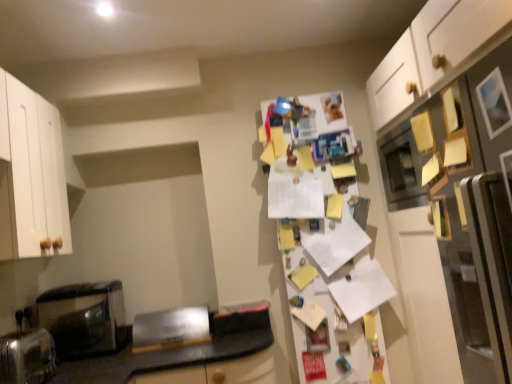
This screenshot has width=512, height=384. I want to click on brushed metal toaster at lower left, which is the first appliance from right to left, so click(170, 329).

Considering the points (55, 313) and (40, 372), which point is in front, point (55, 313) or point (40, 372)?

The point (40, 372) is in front.

Can you confirm if black glossy microwave at left is wider than satin silver toaster at lower left, arranged as the second appliance when viewed from the back?

Correct, the width of black glossy microwave at left exceeds that of satin silver toaster at lower left, arranged as the second appliance when viewed from the back.

From a real-world perspective, is black glossy microwave at left under satin silver toaster at lower left, placed as the first appliance when sorted from front to back?

Actually, black glossy microwave at left is physically above satin silver toaster at lower left, placed as the first appliance when sorted from front to back, in the real world.

Is white paper covered fridge at center, which ranks as the 1th fridge in back-to-front order, outside of white matte refrigerator at right, the second fridge when ordered from back to front?

Absolutely, white paper covered fridge at center, which ranks as the 1th fridge in back-to-front order, is external to white matte refrigerator at right, the second fridge when ordered from back to front.

Which object is wider, white paper covered fridge at center, the first fridge positioned from the left, or white matte refrigerator at right, the second fridge when ordered from back to front?

white matte refrigerator at right, the second fridge when ordered from back to front, is wider.

Which of these two, white paper covered fridge at center, the first fridge positioned from the left, or white matte refrigerator at right, which appears as the first fridge when viewed from the front, stands shorter?

white matte refrigerator at right, which appears as the first fridge when viewed from the front.

Identify the location of fridge behind the white matte refrigerator at right, the first fridge positioned from the right. (326, 249).

Looking at this image, is brushed metal toaster at lower left, which is the 2th appliance from front to back, facing away from white paper covered fridge at center, which ranks as the 1th fridge in back-to-front order?

No, brushed metal toaster at lower left, which is the 2th appliance from front to back, is not facing the opposite direction of white paper covered fridge at center, which ranks as the 1th fridge in back-to-front order.

The height and width of the screenshot is (384, 512). Identify the location of the 2nd fridge directly above the brushed metal toaster at lower left, which is the 2th appliance from front to back (from a real-world perspective). (326, 249).

Does point (143, 318) appear closer or farther from the camera than point (284, 214)?

Point (143, 318) is positioned closer to the camera compared to point (284, 214).

Is satin silver toaster at lower left, arranged as the second appliance when viewed from the back, closer to camera compared to black glossy microwave at left?

Yes, satin silver toaster at lower left, arranged as the second appliance when viewed from the back, is closer to the viewer.

Considering the relative sizes of satin silver toaster at lower left, the first appliance viewed from the left, and black glossy microwave at left in the image provided, is satin silver toaster at lower left, the first appliance viewed from the left, taller than black glossy microwave at left?

Incorrect, the height of satin silver toaster at lower left, the first appliance viewed from the left, is not larger of that of black glossy microwave at left.

Considering the positions of points (19, 358) and (102, 351), is point (19, 358) closer to camera compared to point (102, 351)?

That is True.

Considering the relative sizes of satin silver toaster at lower left, arranged as the second appliance when viewed from the back, and black glossy microwave at left in the image provided, is satin silver toaster at lower left, arranged as the second appliance when viewed from the back, thinner than black glossy microwave at left?

Yes.

Looking at this image, from the image's perspective, is brushed metal toaster at lower left, which is the first appliance from right to left, located beneath white matte refrigerator at right, the second fridge in the left-to-right sequence?

Correct, brushed metal toaster at lower left, which is the first appliance from right to left, appears lower than white matte refrigerator at right, the second fridge in the left-to-right sequence, in the image.

Would you say brushed metal toaster at lower left, which is the 2th appliance from front to back, is a long distance from white matte refrigerator at right, which appears as the first fridge when viewed from the front?

Yes, brushed metal toaster at lower left, which is the 2th appliance from front to back, and white matte refrigerator at right, which appears as the first fridge when viewed from the front, are quite far apart.

How distant is brushed metal toaster at lower left, which is the first appliance from right to left, from white matte refrigerator at right, the first fridge positioned from the right?

brushed metal toaster at lower left, which is the first appliance from right to left, is 1.34 meters from white matte refrigerator at right, the first fridge positioned from the right.

Which object is more forward, brushed metal toaster at lower left, which is the first appliance from right to left, or white matte refrigerator at right, which appears as the first fridge when viewed from the front?

white matte refrigerator at right, which appears as the first fridge when viewed from the front, is closer to the camera.

Considering the relative sizes of white matte refrigerator at right, the second fridge in the left-to-right sequence, and black glossy microwave at left in the image provided, is white matte refrigerator at right, the second fridge in the left-to-right sequence, thinner than black glossy microwave at left?

No.

Does white matte refrigerator at right, the second fridge when ordered from back to front, have a lesser height compared to black glossy microwave at left?

Incorrect, the height of white matte refrigerator at right, the second fridge when ordered from back to front, does not fall short of that of black glossy microwave at left.

From the picture: From a real-world perspective, who is located lower, white matte refrigerator at right, the first fridge positioned from the right, or black glossy microwave at left?

In real-world perspective, black glossy microwave at left is lower.

From the image's perspective, between black glossy microwave at left and brushed metal toaster at lower left, the 1th appliance from the back, which one is located above?

black glossy microwave at left is shown above in the image.

Looking at this image, does black glossy microwave at left turn towards brushed metal toaster at lower left, the 2th appliance viewed from the left?

No, black glossy microwave at left is not oriented towards brushed metal toaster at lower left, the 2th appliance viewed from the left.

Is black glossy microwave at left in front of or behind brushed metal toaster at lower left, which is the first appliance from right to left, in the image?

black glossy microwave at left is positioned farther from the viewer than brushed metal toaster at lower left, which is the first appliance from right to left.

Considering the relative positions of black glossy microwave at left and brushed metal toaster at lower left, which is the 2th appliance from front to back, in the image provided, is black glossy microwave at left to the left or to the right of brushed metal toaster at lower left, which is the 2th appliance from front to back,?

From the image, it's evident that black glossy microwave at left is to the left of brushed metal toaster at lower left, which is the 2th appliance from front to back.

Find the location of a particular element. This screenshot has width=512, height=384. home appliance on the right of satin silver toaster at lower left, placed as the first appliance when sorted from front to back is located at coordinates (84, 318).

Where is `fridge below the white matte refrigerator at right, the second fridge in the left-to-right sequence (from the image's perspective)`? The height and width of the screenshot is (384, 512). fridge below the white matte refrigerator at right, the second fridge in the left-to-right sequence (from the image's perspective) is located at coordinates (326, 249).

When comparing their distances from white paper covered fridge at center, the first fridge positioned from the left, does white matte refrigerator at right, the second fridge in the left-to-right sequence, or brushed metal toaster at lower left, which is the first appliance from right to left, seem closer?

Among the two, brushed metal toaster at lower left, which is the first appliance from right to left, is located nearer to white paper covered fridge at center, the first fridge positioned from the left.

Which object lies further to the anchor point white paper covered fridge at center, the 2th fridge from the right, brushed metal toaster at lower left, the 2th appliance viewed from the left, or satin silver toaster at lower left, the first appliance viewed from the left?

Among the two, satin silver toaster at lower left, the first appliance viewed from the left, is located further to white paper covered fridge at center, the 2th fridge from the right.

Estimate the real-world distances between objects in this image. Which object is further from satin silver toaster at lower left, the first appliance viewed from the left, brushed metal toaster at lower left, the 1th appliance from the back, or white matte refrigerator at right, the second fridge in the left-to-right sequence?

The object further to satin silver toaster at lower left, the first appliance viewed from the left, is white matte refrigerator at right, the second fridge in the left-to-right sequence.

Consider the image. Estimate the real-world distances between objects in this image. Which object is further from brushed metal toaster at lower left, the 1th appliance from the back, white paper covered fridge at center, the first fridge positioned from the left, or satin silver toaster at lower left, the first appliance viewed from the left?

Among the two, white paper covered fridge at center, the first fridge positioned from the left, is located further to brushed metal toaster at lower left, the 1th appliance from the back.

Estimate the real-world distances between objects in this image. Which object is further from brushed metal toaster at lower left, the 1th appliance from the back, white paper covered fridge at center, the 2th fridge from the right, or white matte refrigerator at right, which appears as the first fridge when viewed from the front?

Among the two, white matte refrigerator at right, which appears as the first fridge when viewed from the front, is located further to brushed metal toaster at lower left, the 1th appliance from the back.

Looking at the image, which one is located further to black glossy microwave at left, white paper covered fridge at center, which ranks as the 1th fridge in back-to-front order, or white matte refrigerator at right, which appears as the first fridge when viewed from the front?

white matte refrigerator at right, which appears as the first fridge when viewed from the front.

Based on their spatial positions, is white matte refrigerator at right, the second fridge in the left-to-right sequence, or black glossy microwave at left further from white paper covered fridge at center, which ranks as the 1th fridge in back-to-front order?

black glossy microwave at left is further to white paper covered fridge at center, which ranks as the 1th fridge in back-to-front order.

From the image, which object appears to be farther from white paper covered fridge at center, the first fridge positioned from the left, black glossy microwave at left or satin silver toaster at lower left, arranged as the second appliance when viewed from the back?

satin silver toaster at lower left, arranged as the second appliance when viewed from the back, is further to white paper covered fridge at center, the first fridge positioned from the left.

This screenshot has height=384, width=512. I want to click on appliance between black glossy microwave at left and white matte refrigerator at right, the second fridge in the left-to-right sequence, so click(170, 329).

The height and width of the screenshot is (384, 512). I want to click on appliance between satin silver toaster at lower left, the first appliance viewed from the left, and white matte refrigerator at right, which appears as the first fridge when viewed from the front, so click(170, 329).

At what (x,y) coordinates should I click in order to perform the action: click on fridge situated between black glossy microwave at left and white matte refrigerator at right, which appears as the first fridge when viewed from the front, from left to right. Please return your answer as a coordinate pair (x, y). Looking at the image, I should click on (326, 249).

At what (x,y) coordinates should I click in order to perform the action: click on home appliance located between satin silver toaster at lower left, arranged as the second appliance when viewed from the back, and white paper covered fridge at center, acting as the second fridge starting from the front, in the left-right direction. Please return your answer as a coordinate pair (x, y). The width and height of the screenshot is (512, 384). Looking at the image, I should click on (84, 318).